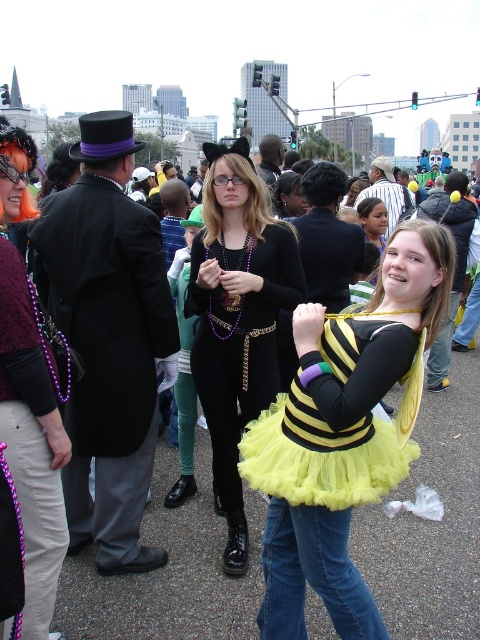
You are a photographer at the event and want to capture both the black matte tutu at center and the yellow tulle dress at center in a single shot. Which one of these two items is positioned higher in the frame?

The black matte tutu at center is above the yellow tulle dress at center, so it is positioned higher in the frame.

You are a photographer trying to capture the two women in the center of the image. The yellow tulle dress at center and the matte black dress at center. Which one is positioned lower in the frame?

The yellow tulle dress at center is located below the matte black dress at center, so the yellow tulle dress at center is positioned lower in the frame.